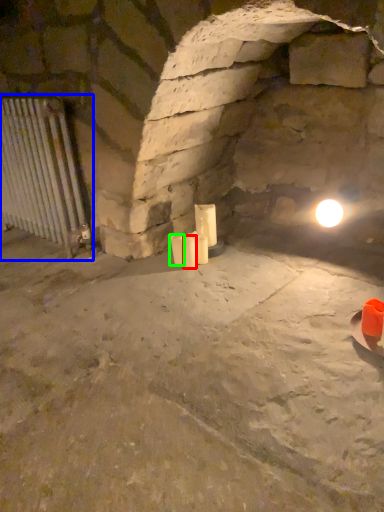
Question: Estimate the real-world distances between objects in this image. Which object is closer to candle (highlighted by a red box), cage (highlighted by a blue box) or candle (highlighted by a green box)?

Choices:
 (A) cage
 (B) candle

Answer: (B)